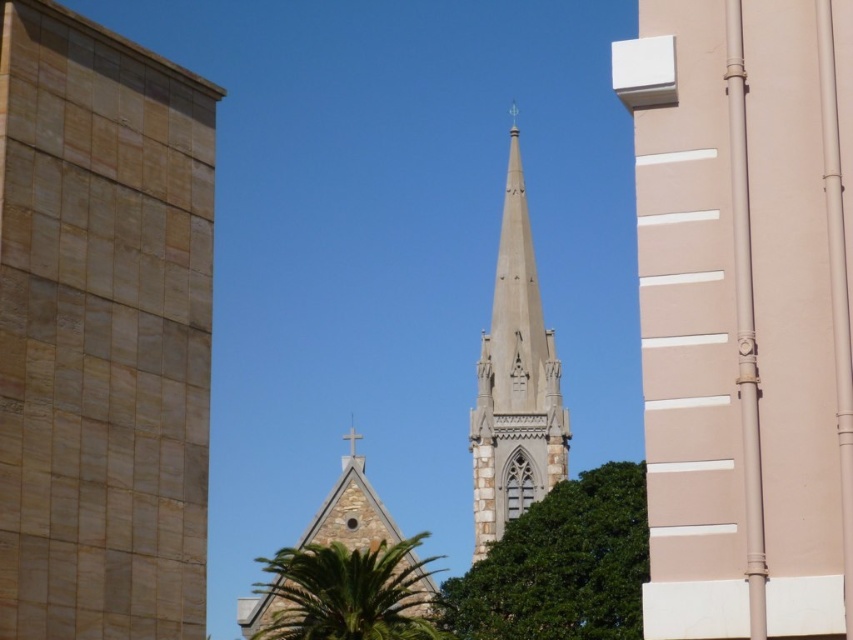
This screenshot has height=640, width=853. What do you see at coordinates (515, 380) in the screenshot? I see `white stone spire at center` at bounding box center [515, 380].

Does white stone spire at center have a lesser width compared to stone steeple at center?

Yes.

Which is in front, point (544, 362) or point (434, 586)?

Point (434, 586) is in front.

Image resolution: width=853 pixels, height=640 pixels. In order to click on white stone spire at center in this screenshot , I will do `click(515, 380)`.

Who is higher up, beige stone tower at center or green leafy palm tree at center?

beige stone tower at center

I want to click on beige stone tower at center, so click(x=102, y=332).

Is point (167, 285) positioned before point (287, 561)?

Yes, it is in front of point (287, 561).

Where is `beige stone tower at center`? beige stone tower at center is located at coordinates (102, 332).

Who is positioned more to the right, beige stone tower at center or green leafy tree at center?

green leafy tree at center is more to the right.

The image size is (853, 640). I want to click on beige stone tower at center, so click(102, 332).